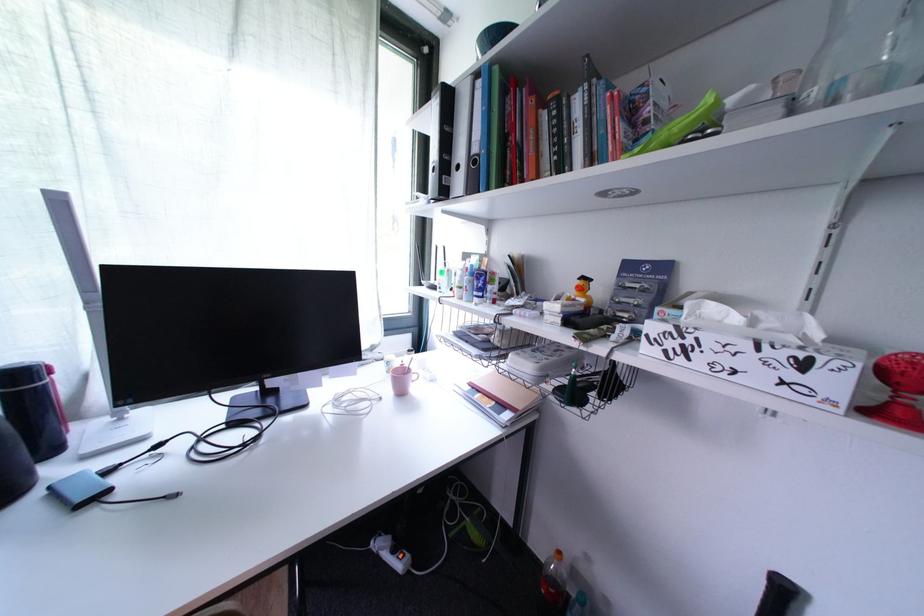
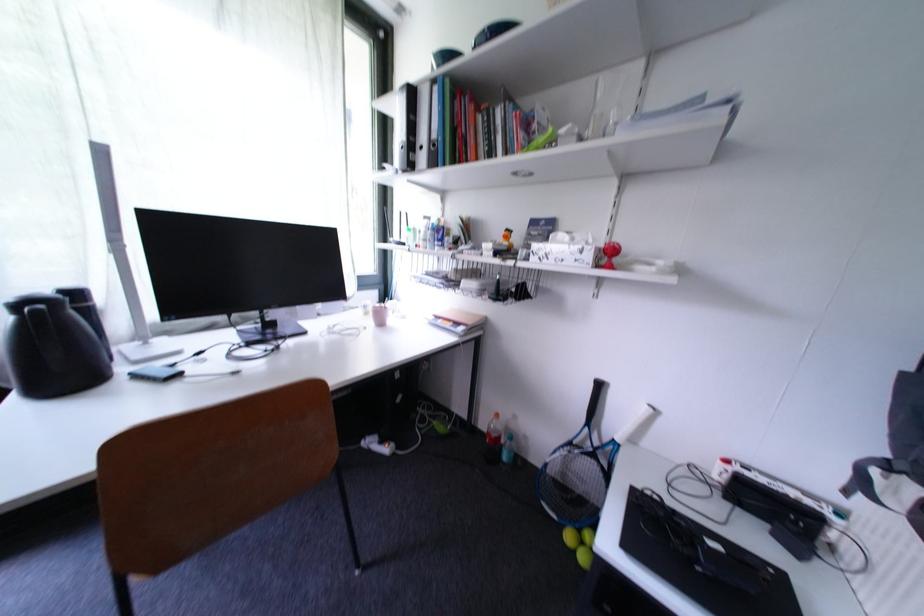
In the second image, find the point that corresponds to (822,95) in the first image.

(594, 136)